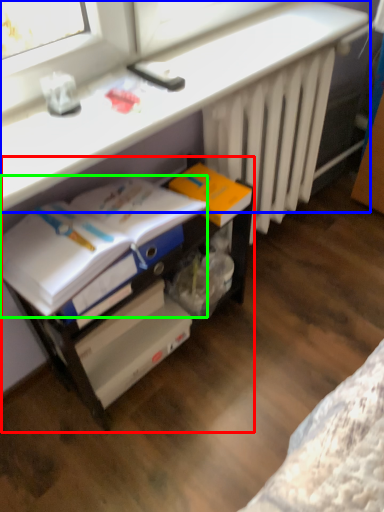
Question: Which object is the farthest from file cabinet (highlighted by a red box)? Choose among these: computer (highlighted by a blue box) or magazine (highlighted by a green box).

Choices:
 (A) computer
 (B) magazine

Answer: (A)